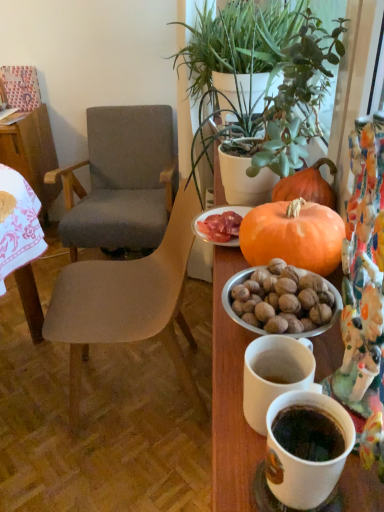
Question: Is orange matte pumpkin at center bigger than textured gray fabric chair at left, which is counted as the 2th chair, starting from the back?

Choices:
 (A) yes
 (B) no

Answer: (B)

Question: Is the position of orange matte pumpkin at center less distant than that of textured gray fabric chair at left, the 1th chair in the front-to-back sequence?

Choices:
 (A) no
 (B) yes

Answer: (B)

Question: From the image's perspective, is orange matte pumpkin at center above textured gray fabric chair at left, the 1th chair in the front-to-back sequence?

Choices:
 (A) yes
 (B) no

Answer: (A)

Question: Is orange matte pumpkin at center facing away from textured gray fabric chair at left, which is counted as the 2th chair, starting from the back?

Choices:
 (A) no
 (B) yes

Answer: (A)

Question: Is orange matte pumpkin at center located outside textured gray fabric chair at left, the 1th chair in the front-to-back sequence?

Choices:
 (A) yes
 (B) no

Answer: (A)

Question: Is textured gray fabric chair at left, the 1th chair in the front-to-back sequence, spatially inside matte orange plate at center, or outside of it?

Choices:
 (A) inside
 (B) outside

Answer: (B)

Question: From a real-world perspective, is textured gray fabric chair at left, the 1th chair in the front-to-back sequence, physically located above or below matte orange plate at center?

Choices:
 (A) below
 (B) above

Answer: (A)

Question: In the image, is textured gray fabric chair at left, the 1th chair in the front-to-back sequence, on the left side or the right side of matte orange plate at center?

Choices:
 (A) left
 (B) right

Answer: (A)

Question: Considering the positions of textured gray fabric chair at left, which is counted as the 2th chair, starting from the back, and matte orange plate at center in the image, is textured gray fabric chair at left, which is counted as the 2th chair, starting from the back, wider or thinner than matte orange plate at center?

Choices:
 (A) wide
 (B) thin

Answer: (A)

Question: Considering their positions, is white ceramic mug at lower right located in front of or behind textured gray fabric chair at left, which is counted as the 2th chair, starting from the back?

Choices:
 (A) front
 (B) behind

Answer: (A)

Question: In terms of width, does white ceramic mug at lower right look wider or thinner when compared to textured gray fabric chair at left, the 1th chair in the front-to-back sequence?

Choices:
 (A) thin
 (B) wide

Answer: (A)

Question: From the image's perspective, is white ceramic mug at lower right located above or below textured gray fabric chair at left, the 1th chair in the front-to-back sequence?

Choices:
 (A) above
 (B) below

Answer: (B)

Question: In the image, is white ceramic mug at lower right on the left side or the right side of textured gray fabric chair at left, the 1th chair in the front-to-back sequence?

Choices:
 (A) right
 (B) left

Answer: (A)

Question: Is green leafy plant at upper right, marked as the first houseplant in a front-to-back arrangement, inside or outside of gray fabric chair at center, which is the second chair from front to back?

Choices:
 (A) inside
 (B) outside

Answer: (B)

Question: Considering the positions of green leafy plant at upper right, marked as the first houseplant in a front-to-back arrangement, and gray fabric chair at center, the first chair viewed from the back, in the image, is green leafy plant at upper right, marked as the first houseplant in a front-to-back arrangement, bigger or smaller than gray fabric chair at center, the first chair viewed from the back,?

Choices:
 (A) big
 (B) small

Answer: (B)